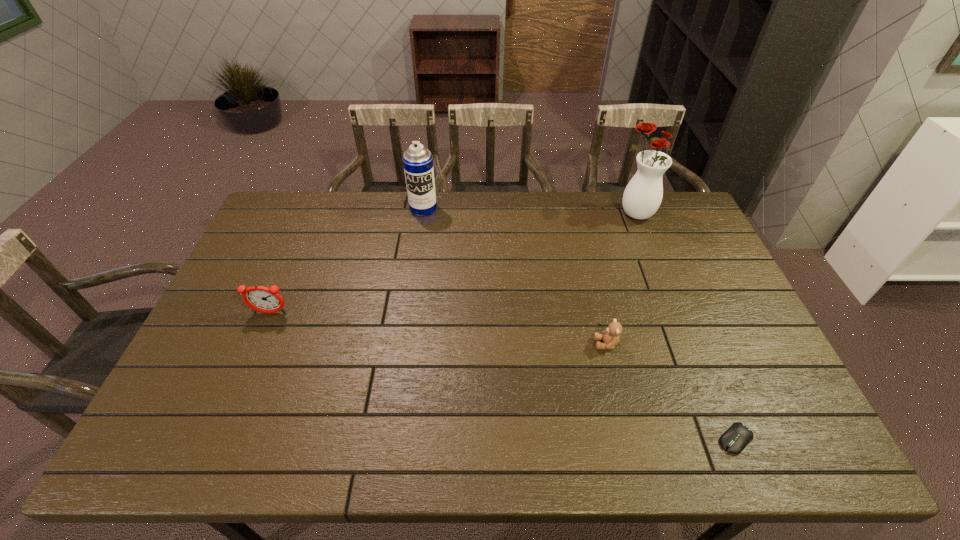
Find the location of a particular element. The width and height of the screenshot is (960, 540). unoccupied area between the third tallest object and the fourth object from right to left is located at coordinates (347, 261).

Identify the location of unoccupied position between the tallest object and the third tallest object. (452, 264).

The width and height of the screenshot is (960, 540). What are the coordinates of `vacant area that lies between the tallest object and the nearest object` in the screenshot? It's located at click(x=685, y=327).

At what (x,y) coordinates should I click in order to perform the action: click on vacant area that lies between the tallest object and the second shortest object. Please return your answer as a coordinate pair (x, y). Looking at the image, I should click on (620, 279).

The image size is (960, 540). I want to click on blank region between the shortest object and the teddy bear, so click(x=671, y=392).

Identify the location of empty location between the shortest object and the third object from right to left. (671, 392).

This screenshot has width=960, height=540. Identify the location of vacant point located between the vase and the computer equipment. pos(685,327).

What are the coordinates of `vacant region between the second tallest object and the vase` in the screenshot? It's located at click(x=529, y=212).

At what (x,y) coordinates should I click in order to perform the action: click on unoccupied position between the tallest object and the leftmost object. Please return your answer as a coordinate pair (x, y). The width and height of the screenshot is (960, 540). Looking at the image, I should click on point(452,264).

I want to click on object that can be found as the second closest to the aerosol can, so click(642, 197).